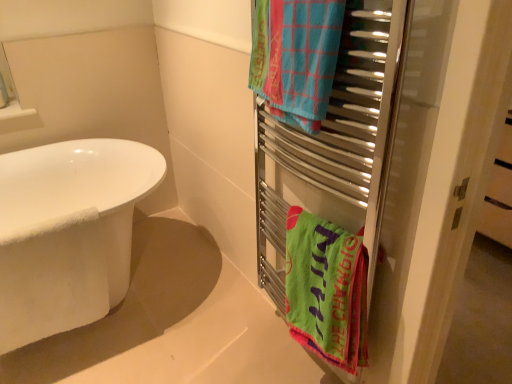
Question: Should I look upward or downward to see metal towel rack at right?

Choices:
 (A) up
 (B) down

Answer: (B)

Question: Considering the relative sizes of blue woven towel at upper right, the 2th towel/napkin positioned from the bottom, and metal towel rack at right in the image provided, is blue woven towel at upper right, the 2th towel/napkin positioned from the bottom, smaller than metal towel rack at right?

Choices:
 (A) yes
 (B) no

Answer: (A)

Question: From a real-world perspective, is blue woven towel at upper right, the 2th towel/napkin positioned from the bottom, physically above metal towel rack at right?

Choices:
 (A) no
 (B) yes

Answer: (B)

Question: Considering the relative sizes of blue woven towel at upper right, the 2th towel/napkin positioned from the bottom, and metal towel rack at right in the image provided, is blue woven towel at upper right, the 2th towel/napkin positioned from the bottom, wider than metal towel rack at right?

Choices:
 (A) no
 (B) yes

Answer: (A)

Question: Does blue woven towel at upper right, the 2th towel/napkin positioned from the bottom, have a lesser height compared to metal towel rack at right?

Choices:
 (A) yes
 (B) no

Answer: (A)

Question: Are blue woven towel at upper right, which appears as the 1th towel/napkin when viewed from the top, and metal towel rack at right making contact?

Choices:
 (A) yes
 (B) no

Answer: (B)

Question: Can you confirm if blue woven towel at upper right, the 2th towel/napkin positioned from the bottom, is thinner than metal towel rack at right?

Choices:
 (A) yes
 (B) no

Answer: (A)

Question: From the image's perspective, does blue woven towel at upper right, the 2th towel/napkin positioned from the bottom, appear lower than white glossy bathtub at left?

Choices:
 (A) yes
 (B) no

Answer: (B)

Question: Considering the relative sizes of blue woven towel at upper right, the 2th towel/napkin positioned from the bottom, and white glossy bathtub at left in the image provided, is blue woven towel at upper right, the 2th towel/napkin positioned from the bottom, taller than white glossy bathtub at left?

Choices:
 (A) yes
 (B) no

Answer: (B)

Question: From the image's perspective, is blue woven towel at upper right, the 2th towel/napkin positioned from the bottom, over white glossy bathtub at left?

Choices:
 (A) yes
 (B) no

Answer: (A)

Question: Is blue woven towel at upper right, which appears as the 1th towel/napkin when viewed from the top, positioned far away from white glossy bathtub at left?

Choices:
 (A) yes
 (B) no

Answer: (A)

Question: Is blue woven towel at upper right, which appears as the 1th towel/napkin when viewed from the top, in front of white glossy bathtub at left?

Choices:
 (A) yes
 (B) no

Answer: (A)

Question: Can you confirm if blue woven towel at upper right, the 2th towel/napkin positioned from the bottom, is wider than white glossy bathtub at left?

Choices:
 (A) no
 (B) yes

Answer: (A)

Question: Is metal towel rack at right next to green fabric towel at right, arranged as the first towel/napkin when ordered from the bottom, and touching it?

Choices:
 (A) no
 (B) yes

Answer: (A)